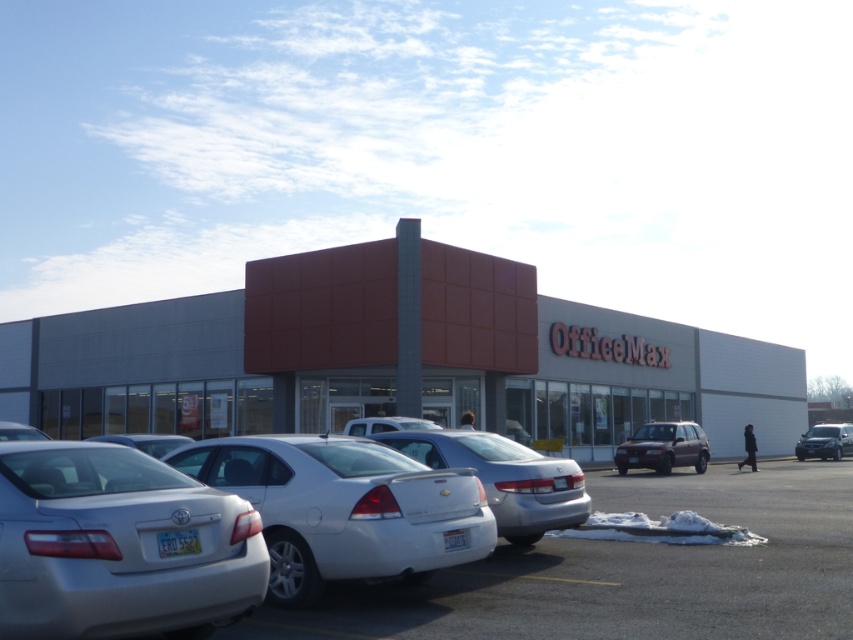
Is silver metallic sedan at lower left bigger than satin black suv at right?

Actually, silver metallic sedan at lower left might be smaller than satin black suv at right.

Which is more to the left, silver metallic sedan at lower left or satin black suv at right?

silver metallic sedan at lower left is more to the left.

Which is in front, point (94, 621) or point (809, 440)?

Positioned in front is point (94, 621).

Image resolution: width=853 pixels, height=640 pixels. I want to click on silver metallic sedan at lower left, so click(x=119, y=545).

Which is more to the left, satin white sedan at center or white matte car at center?

From the viewer's perspective, satin white sedan at center appears more on the left side.

Can you confirm if satin white sedan at center is positioned to the right of white matte car at center?

No, satin white sedan at center is not to the right of white matte car at center.

Who is more forward, (200, 449) or (416, 426)?

Positioned in front is point (200, 449).

The height and width of the screenshot is (640, 853). In order to click on satin white sedan at center in this screenshot , I will do `click(343, 508)`.

Between point (419, 456) and point (688, 429), which one is positioned behind?

The point (688, 429) is behind.

Does satin silver sedan at center have a smaller size compared to satin gold suv at center?

No, satin silver sedan at center is not smaller than satin gold suv at center.

Is point (495, 445) in front of point (666, 448)?

Yes, point (495, 445) is in front of point (666, 448).

Where is `satin silver sedan at center`? The image size is (853, 640). satin silver sedan at center is located at coordinates (503, 477).